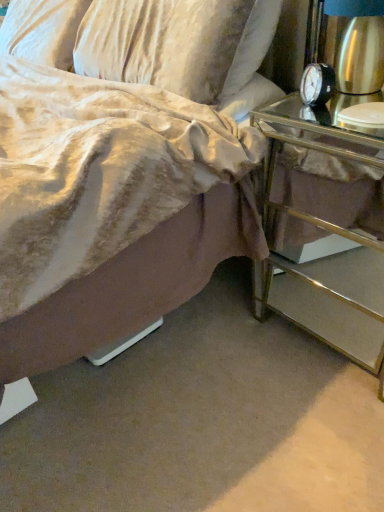
This screenshot has height=512, width=384. In order to click on vacant space positioned to the left of metallic mirrored nightstand at right in this screenshot , I will do `click(222, 357)`.